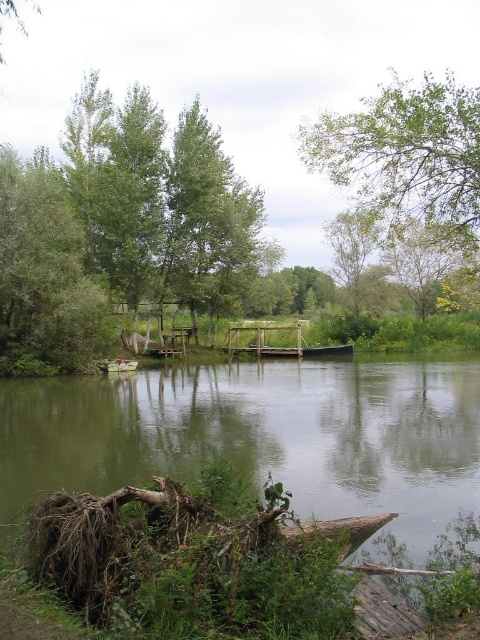
Question: Which of these objects is positioned closest to the wooden canoe at center?

Choices:
 (A) green leafy tree at left
 (B) green leafy tree at upper center
 (C) green plastic boat at lower left
 (D) green leafy tree at upper right

Answer: (D)

Question: Does green leafy tree at upper center have a greater width compared to green plastic boat at lower left?

Choices:
 (A) yes
 (B) no

Answer: (A)

Question: Which point is farther from the camera taking this photo?

Choices:
 (A) (439, 513)
 (B) (19, 330)
 (C) (105, 365)

Answer: (C)

Question: Is green leafy tree at upper right bigger than green plastic boat at lower left?

Choices:
 (A) no
 (B) yes

Answer: (B)

Question: Can you confirm if wooden canoe at center is positioned to the left of green plastic boat at lower left?

Choices:
 (A) yes
 (B) no

Answer: (B)

Question: Which of the following is the closest to the observer?

Choices:
 (A) green leafy tree at upper center
 (B) green plastic boat at lower left
 (C) green wood lake at center
 (D) green leafy tree at upper right

Answer: (C)